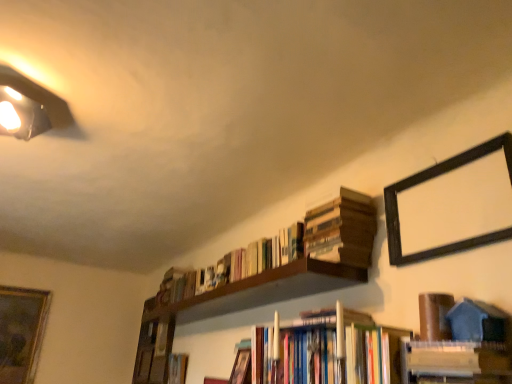
Question: Is wooden book at upper right, which is the 4th book from front to back, wider or thinner than white glossy book at lower right, placed as the seventh book when sorted from back to front?

Choices:
 (A) wide
 (B) thin

Answer: (A)

Question: In terms of size, does wooden book at upper right, placed as the fourth book when sorted from back to front, appear bigger or smaller than white glossy book at lower right, the 1th book positioned from the front?

Choices:
 (A) small
 (B) big

Answer: (B)

Question: Estimate the real-world distances between objects in this image. Which object is closer to the brown matte book at upper right, placed as the 3th book when sorted from front to back?

Choices:
 (A) hardcover book at center, which is the 1th book from back to front
 (B) wooden book at upper right, which is the 4th book from front to back
 (C) hardcover books at center, which ranks as the 2th book in front-to-back order
 (D) wooden bookshelf at lower left
 (E) black wood picture frame at upper right, acting as the second picture frame starting from the bottom

Answer: (E)

Question: Considering the real-world distances, which object is farthest from the white glossy book at lower right, the 1th book positioned from the front?

Choices:
 (A) hardcover book at center, which is the 1th book from back to front
 (B) wooden book at upper right, placed as the fourth book when sorted from back to front
 (C) hardcover books at center, which ranks as the 2th book in front-to-back order
 (D) hardcover books at upper center, positioned as the fifth book in front-to-back order
 (E) hardcover book at center, arranged as the 2th book when viewed from the back

Answer: (A)